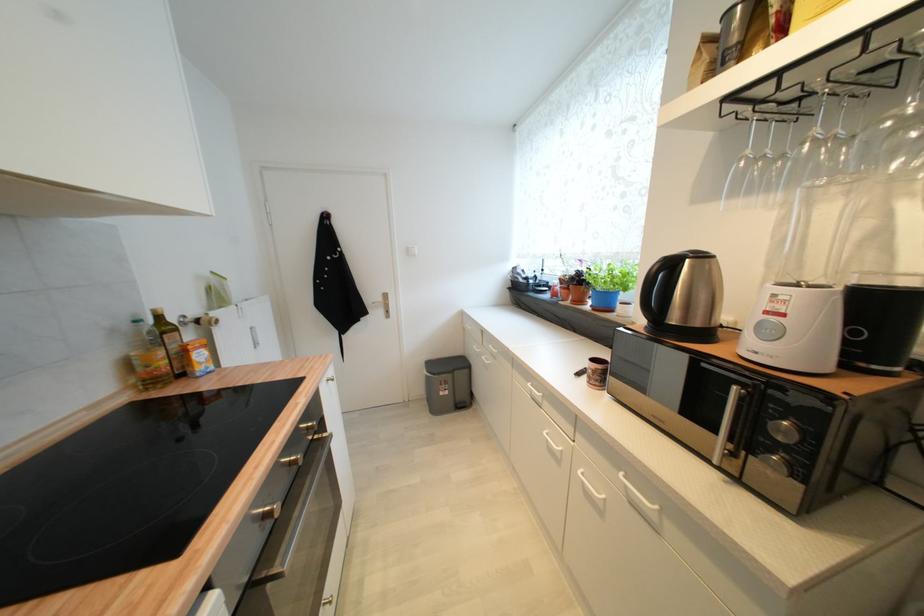
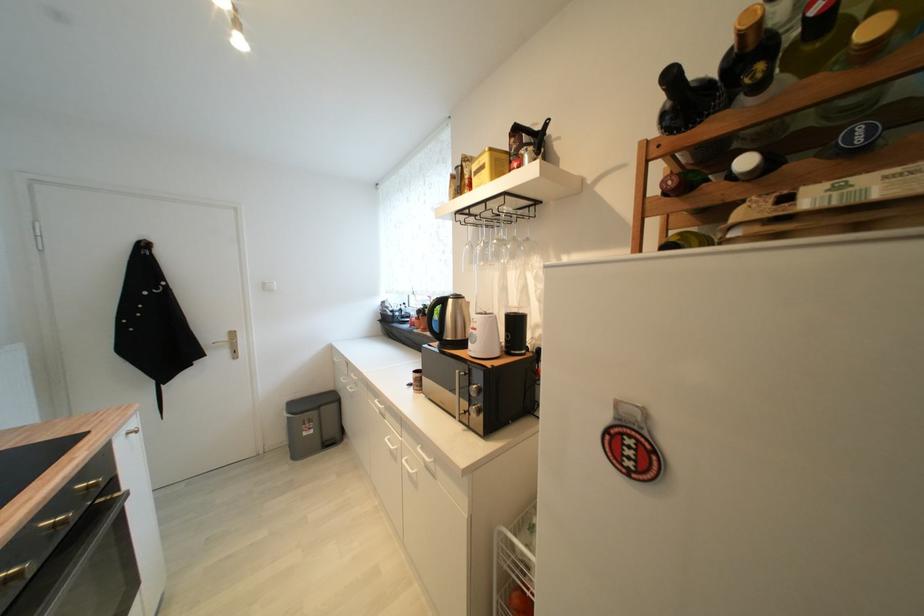
The point at (885, 310) is marked in the first image. Where is the corresponding point in the second image?

(521, 325)